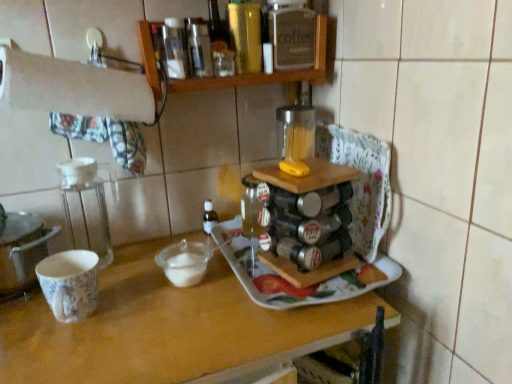
The image size is (512, 384). Identify the location of free location to the left of white ceramic tray at center. (132, 288).